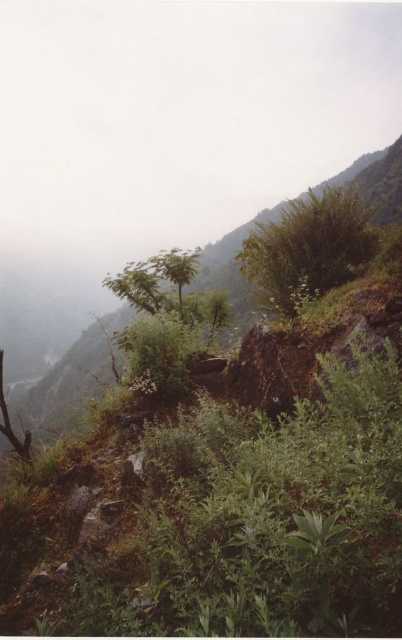
You are a hiker navigating through the valley and need to locate both the green leafy bush at center and the green leafy tree at center. Which one is positioned to the right when viewed from your perspective?

The green leafy bush at center is to the right of the green leafy tree at center, so the bush is positioned to the right when viewed from your perspective.

You are a hiker navigating the terrain and need to determine the relative positions of the green leafy bush at center and the green leafy tree at left. Which one is higher up in the landscape?

The green leafy bush at center is higher up in the landscape than the green leafy tree at left because it is positioned above it.

You are a hiker navigating through this landscape and need to decide whether to take a path that goes around the green leafy bush at center or through the green leafy tree at left. Which path would allow you to conserve more energy, considering the size of the obstacles?

The green leafy bush at center is larger in size than the green leafy tree at left, so going around the tree would require less effort and conserve more energy since it is smaller.